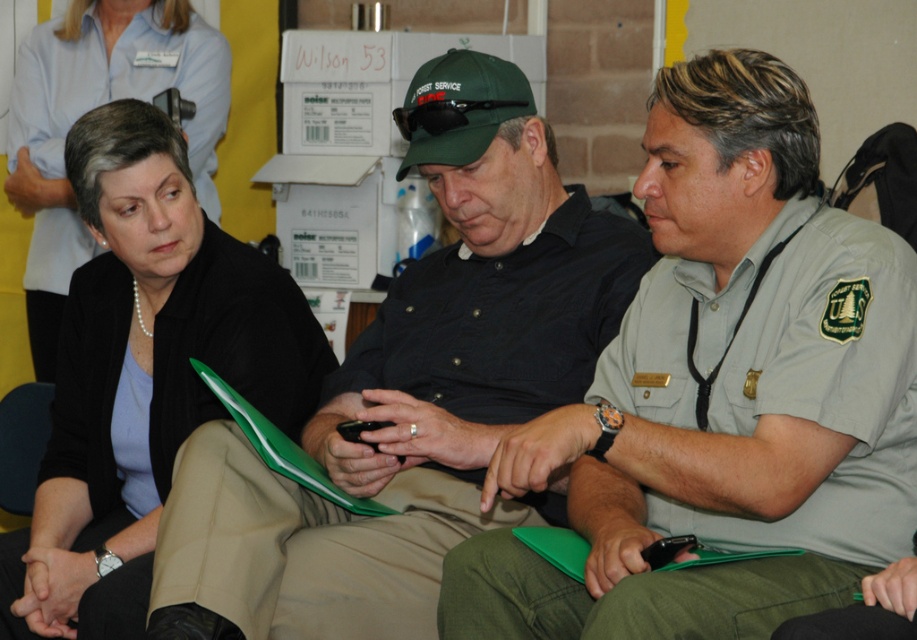
Question: Which object appears closest to the camera in this image?

Choices:
 (A) green uniform shirt at center
 (B) pearl necklace at left
 (C) matte black shirt at center
 (D) pearl necklace at upper left

Answer: (A)

Question: Among these objects, which one is farthest from the camera?

Choices:
 (A) green uniform shirt at center
 (B) pearl necklace at upper left
 (C) pearl necklace at left
 (D) matte black shirt at center

Answer: (C)

Question: Can you confirm if green uniform shirt at center is wider than pearl necklace at upper left?

Choices:
 (A) yes
 (B) no

Answer: (A)

Question: Estimate the real-world distances between objects in this image. Which object is closer to the matte black shirt at center?

Choices:
 (A) pearl necklace at upper left
 (B) pearl necklace at left
 (C) green uniform shirt at center

Answer: (C)

Question: Is green uniform shirt at center thinner than matte black shirt at center?

Choices:
 (A) yes
 (B) no

Answer: (A)

Question: Can you confirm if green uniform shirt at center is smaller than pearl necklace at upper left?

Choices:
 (A) yes
 (B) no

Answer: (A)